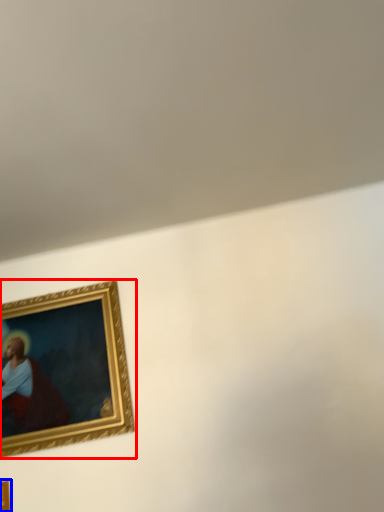
Question: Which of the following is the farthest to the observer, picture frame (highlighted by a red box) or picture frame (highlighted by a blue box)?

Choices:
 (A) picture frame
 (B) picture frame

Answer: (A)